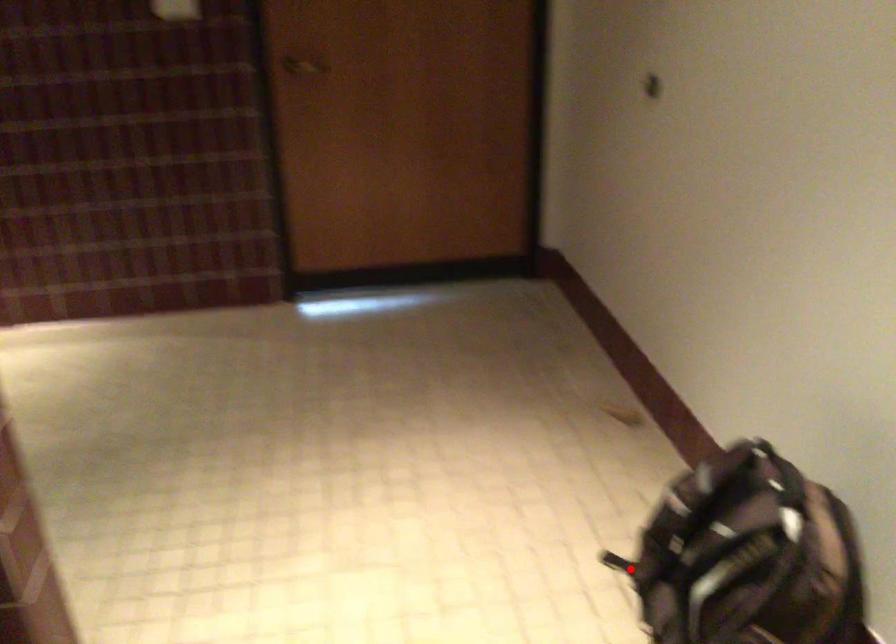
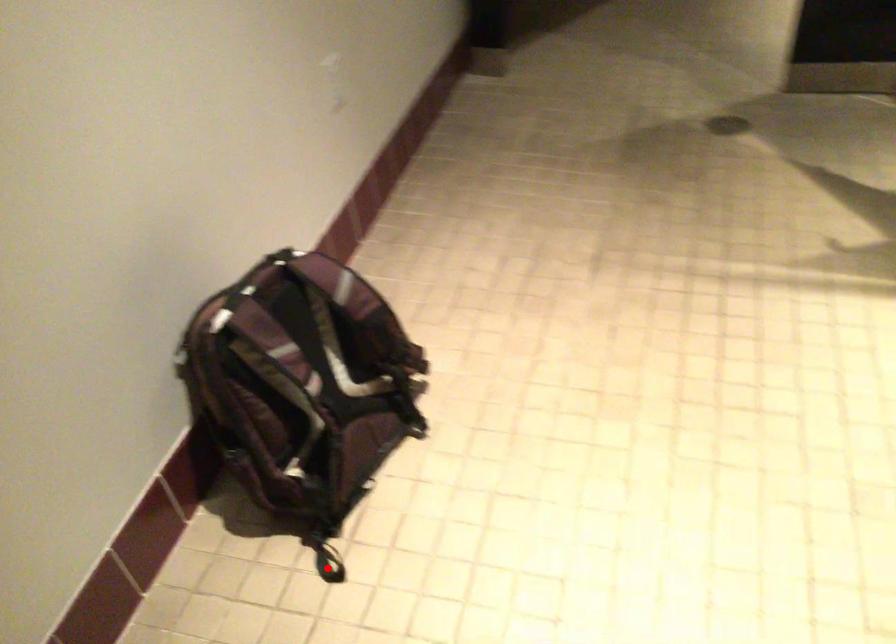
I am providing you with two images of the same scene from different viewpoints. A red point is marked on the first image and another point is marked on the second image. Are the points marked in image1 and image2 representing the same 3D position?

Yes